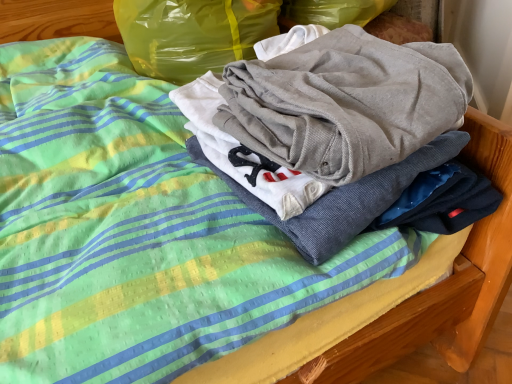
This screenshot has width=512, height=384. What do you see at coordinates (192, 34) in the screenshot? I see `translucent yellow bean bag at upper center` at bounding box center [192, 34].

Locate an element on the screen. The width and height of the screenshot is (512, 384). translucent yellow bean bag at upper center is located at coordinates (192, 34).

Where is `translucent yellow bean bag at upper center`? The width and height of the screenshot is (512, 384). translucent yellow bean bag at upper center is located at coordinates (192, 34).